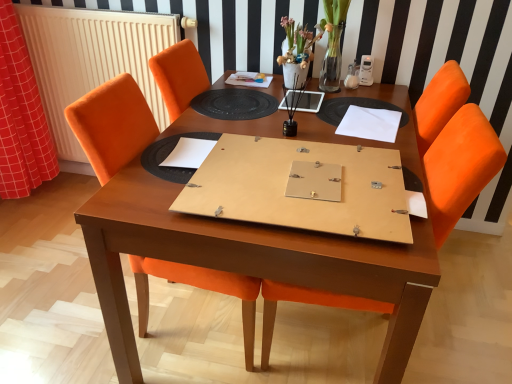
What is the approximate height of white paper at center, acting as the first notebook starting from the left?

It is 0.78 inches.

What do you see at coordinates (234, 104) in the screenshot? I see `black rubber placemat at center` at bounding box center [234, 104].

What are the coordinates of `white radiator at left` in the screenshot? It's located at (92, 59).

Identify the location of orange fabric chair at center, which appears as the 2th chair when viewed from the left. (460, 167).

What is the approximate height of wooden table at center?

wooden table at center is 30.60 inches in height.

Describe the element at coordinates (112, 125) in the screenshot. The height and width of the screenshot is (384, 512). I see `orange fabric chair at center, the 2th chair when ordered from right to left` at that location.

This screenshot has height=384, width=512. In order to click on white paper at center, which is the first notebook from front to back in this screenshot , I will do `click(189, 153)`.

In the scene shown: Between white paper at upper right, placed as the 1th notebook when sorted from back to front, and black rubber placemat at center, which one appears on the right side from the viewer's perspective?

Positioned to the right is white paper at upper right, placed as the 1th notebook when sorted from back to front.

Is white paper at upper right, which is the second notebook from front to back, taller or shorter than black rubber placemat at center?

Clearly, white paper at upper right, which is the second notebook from front to back, is taller compared to black rubber placemat at center.

In the image, is white paper at upper right, which is the 1th notebook in top-to-bottom order, positioned in front of or behind black rubber placemat at center?

Clearly, white paper at upper right, which is the 1th notebook in top-to-bottom order, is in front of black rubber placemat at center.

How different are the orientations of white paper at upper right, the 1th notebook when ordered from right to left, and black rubber placemat at center in degrees?

7.76 degrees.

Is black rubber placemat at center in front of or behind orange fabric chair at center, which appears as the 2th chair when viewed from the left, in the image?

black rubber placemat at center is behind orange fabric chair at center, which appears as the 2th chair when viewed from the left.

Considering the positions of point (197, 110) and point (275, 298), is point (197, 110) closer or farther from the camera than point (275, 298)?

Clearly, point (197, 110) is more distant from the camera than point (275, 298).

From a real-world perspective, is black rubber placemat at center positioned over orange fabric chair at center, which appears as the 2th chair when viewed from the left, based on gravity?

Indeed, from a real-world perspective, black rubber placemat at center stands above orange fabric chair at center, which appears as the 2th chair when viewed from the left.

Can you tell me how much black rubber placemat at center and orange fabric chair at center, which is the first chair in right-to-left order, differ in facing direction?

0.35 degrees separate the facing orientations of black rubber placemat at center and orange fabric chair at center, which is the first chair in right-to-left order.

Considering their positions, is black rubber placemat at center located in front of or behind orange fabric chair at center, the 1th chair from the left?

In the image, black rubber placemat at center appears behind orange fabric chair at center, the 1th chair from the left.

Is black rubber placemat at center spatially inside orange fabric chair at center, the 1th chair from the left, or outside of it?

black rubber placemat at center cannot be found inside orange fabric chair at center, the 1th chair from the left.

Looking at this image, can you confirm if black rubber placemat at center is shorter than orange fabric chair at center, the 1th chair from the left?

Correct, black rubber placemat at center is not as tall as orange fabric chair at center, the 1th chair from the left.

Is black rubber placemat at center not near orange fabric chair at center, the 1th chair from the left?

Actually, black rubber placemat at center and orange fabric chair at center, the 1th chair from the left, are a little close together.

Is white radiator at left positioned far away from red checkered fabric at left?

Actually, white radiator at left and red checkered fabric at left are a little close together.

Is white radiator at left turned away from red checkered fabric at left?

No, white radiator at left is not facing the opposite direction of red checkered fabric at left.

There is a white radiator at left. Find the location of `curtain above it (from a real-world perspective)`. curtain above it (from a real-world perspective) is located at coordinates (21, 116).

Is red checkered fabric at left directly adjacent to white paper at center, which appears as the 2th notebook when viewed from the right?

No, red checkered fabric at left is not in contact with white paper at center, which appears as the 2th notebook when viewed from the right.

Between point (36, 150) and point (177, 148), which one is positioned behind?

The point (36, 150) is farther from the camera.

Is red checkered fabric at left further to the viewer compared to white paper at center, acting as the first notebook starting from the left?

Yes, red checkered fabric at left is further from the viewer.

Is red checkered fabric at left to the left of white paper at center, the 2th notebook when ordered from back to front, from the viewer's perspective?

Indeed, red checkered fabric at left is positioned on the left side of white paper at center, the 2th notebook when ordered from back to front.

From a real-world perspective, does orange fabric chair at center, the 2th chair when ordered from right to left, sit lower than wooden table at center?

No, from a real-world perspective, orange fabric chair at center, the 2th chair when ordered from right to left, is not below wooden table at center.

Is orange fabric chair at center, the 2th chair when ordered from right to left, not near wooden table at center?

No, orange fabric chair at center, the 2th chair when ordered from right to left, is not far from wooden table at center.

Considering the relative sizes of orange fabric chair at center, the 2th chair when ordered from right to left, and wooden table at center in the image provided, is orange fabric chair at center, the 2th chair when ordered from right to left, bigger than wooden table at center?

Incorrect, orange fabric chair at center, the 2th chair when ordered from right to left, is not larger than wooden table at center.

Based on the photo, which object is positioned more to the left, orange fabric chair at center, the 2th chair when ordered from right to left, or wooden table at center?

Positioned to the left is orange fabric chair at center, the 2th chair when ordered from right to left.

From the image's perspective, which object appears higher, white paper at upper right, positioned as the 2th notebook in bottom-to-top order, or wooden table at center?

white paper at upper right, positioned as the 2th notebook in bottom-to-top order, appears higher in the image.

Is white paper at upper right, which is the second notebook from front to back, positioned with its back to wooden table at center?

white paper at upper right, which is the second notebook from front to back, does not have its back to wooden table at center.

How distant is white paper at upper right, the 1th notebook when ordered from right to left, from wooden table at center?

A distance of 15.84 inches exists between white paper at upper right, the 1th notebook when ordered from right to left, and wooden table at center.

Is white paper at upper right, the 2th notebook when ordered from left to right, shorter than wooden table at center?

Correct, white paper at upper right, the 2th notebook when ordered from left to right, is not as tall as wooden table at center.

The width and height of the screenshot is (512, 384). What are the coordinates of `oval that is on the left side of white paper at upper right, the 1th notebook when ordered from right to left` in the screenshot? It's located at (234, 104).

Identify the location of oval located above the orange fabric chair at center, which is the first chair in right-to-left order (from a real-world perspective). This screenshot has width=512, height=384. (234, 104).

Which object lies further to the anchor point red checkered fabric at left, white paper at center, placed as the 1th notebook when sorted from bottom to top, or orange fabric chair at center, the 2th chair when ordered from right to left?

Based on the image, white paper at center, placed as the 1th notebook when sorted from bottom to top, appears to be further to red checkered fabric at left.

Consider the image. Considering their positions, is white paper at center, acting as the 2th notebook starting from the top, positioned further to matte white vase at upper center than black rubber placemat at center?

white paper at center, acting as the 2th notebook starting from the top, is positioned further to the anchor matte white vase at upper center.

Considering their positions, is white paper at center, placed as the 1th notebook when sorted from bottom to top, positioned closer to matte white vase at upper center than wooden table at center?

Based on the image, wooden table at center appears to be nearer to matte white vase at upper center.

Considering their positions, is white paper at center, acting as the first notebook starting from the left, positioned further to white radiator at left than white paper at upper right, the 1th notebook when ordered from right to left?

The object further to white radiator at left is white paper at upper right, the 1th notebook when ordered from right to left.

Consider the image. Which object lies further to the anchor point white paper at center, acting as the first notebook starting from the left, wooden table at center or orange fabric chair at center, the 1th chair from the left?

orange fabric chair at center, the 1th chair from the left.

In the scene shown: Which object lies nearer to the anchor point white radiator at left, white paper at center, acting as the 2th notebook starting from the top, or matte white vase at upper center?

The object closer to white radiator at left is matte white vase at upper center.

Based on their spatial positions, is matte white vase at upper center or white paper at center, acting as the 2th notebook starting from the top, further from red checkered fabric at left?

The object further to red checkered fabric at left is matte white vase at upper center.

Looking at the image, which one is located closer to orange fabric chair at center, which is the first chair in right-to-left order, white paper at center, which is the first notebook from front to back, or matte white vase at upper center?

Among the two, white paper at center, which is the first notebook from front to back, is located nearer to orange fabric chair at center, which is the first chair in right-to-left order.

Where is `chair between matte white vase at upper center and orange fabric chair at center, which appears as the 2th chair when viewed from the left, from top to bottom`? The image size is (512, 384). chair between matte white vase at upper center and orange fabric chair at center, which appears as the 2th chair when viewed from the left, from top to bottom is located at coordinates (112, 125).

Locate an element on the screen. oval between white paper at center, which is the first notebook from front to back, and white paper at upper right, placed as the 1th notebook when sorted from back to front, from left to right is located at coordinates (234, 104).

Where is `radiator between red checkered fabric at left and matte white vase at upper center from left to right`? radiator between red checkered fabric at left and matte white vase at upper center from left to right is located at coordinates (92, 59).

At what (x,y) coordinates should I click in order to perform the action: click on oval between red checkered fabric at left and orange fabric chair at center, which is the first chair in right-to-left order, from left to right. Please return your answer as a coordinate pair (x, y). The width and height of the screenshot is (512, 384). Looking at the image, I should click on (234, 104).